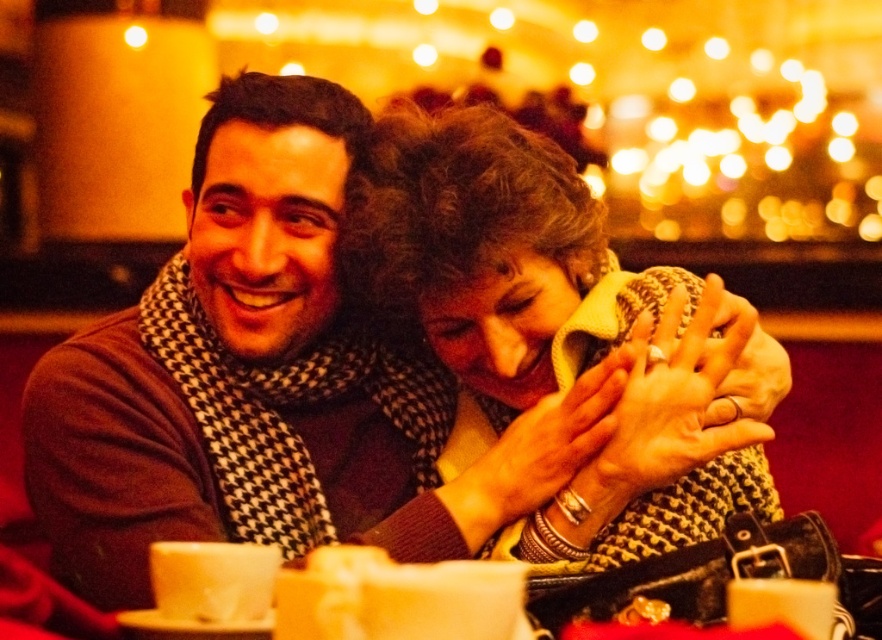
Question: Does brown wool sweater at left appear on the left side of knitted yellow scarf at center?

Choices:
 (A) no
 (B) yes

Answer: (B)

Question: Which point appears farthest from the camera in this image?

Choices:
 (A) (432, 330)
 (B) (288, 154)

Answer: (B)

Question: Where is brown wool sweater at left located in relation to knitted yellow scarf at center in the image?

Choices:
 (A) below
 (B) above

Answer: (B)

Question: Does brown wool sweater at left have a smaller size compared to knitted yellow scarf at center?

Choices:
 (A) no
 (B) yes

Answer: (A)

Question: Among these points, which one is farthest from the camera?

Choices:
 (A) (641, 412)
 (B) (346, 468)

Answer: (B)